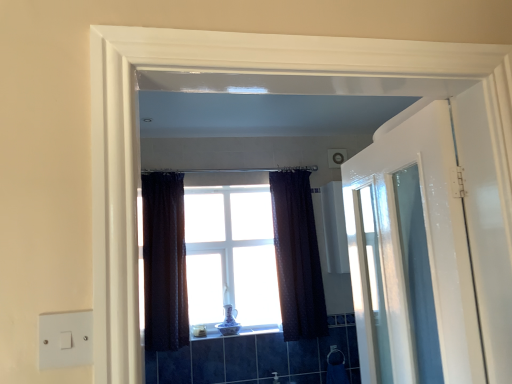
Question: Considering the positions of satin nickel faucet at lower center and dark textured curtain at center, placed as the 2th curtain when sorted from right to left, in the image, is satin nickel faucet at lower center taller or shorter than dark textured curtain at center, placed as the 2th curtain when sorted from right to left,?

Choices:
 (A) short
 (B) tall

Answer: (A)

Question: Is satin nickel faucet at lower center bigger or smaller than dark textured curtain at center, placed as the 2th curtain when sorted from right to left?

Choices:
 (A) small
 (B) big

Answer: (A)

Question: Which object is positioned closest to the dark textured curtain at center, placed as the 2th curtain when sorted from right to left?

Choices:
 (A) white glossy door at right
 (B) white plastic switch at lower left
 (C) white glass window at center
 (D) dark textured curtain at center, the second curtain when ordered from left to right
 (E) satin nickel faucet at lower center

Answer: (C)

Question: Which object is the farthest from the satin nickel faucet at lower center?

Choices:
 (A) white glass window at center
 (B) dark textured curtain at center, acting as the first curtain starting from the left
 (C) white glossy door at right
 (D) white plastic switch at lower left
 (E) dark textured curtain at center, which is the 1th curtain in right-to-left order

Answer: (D)